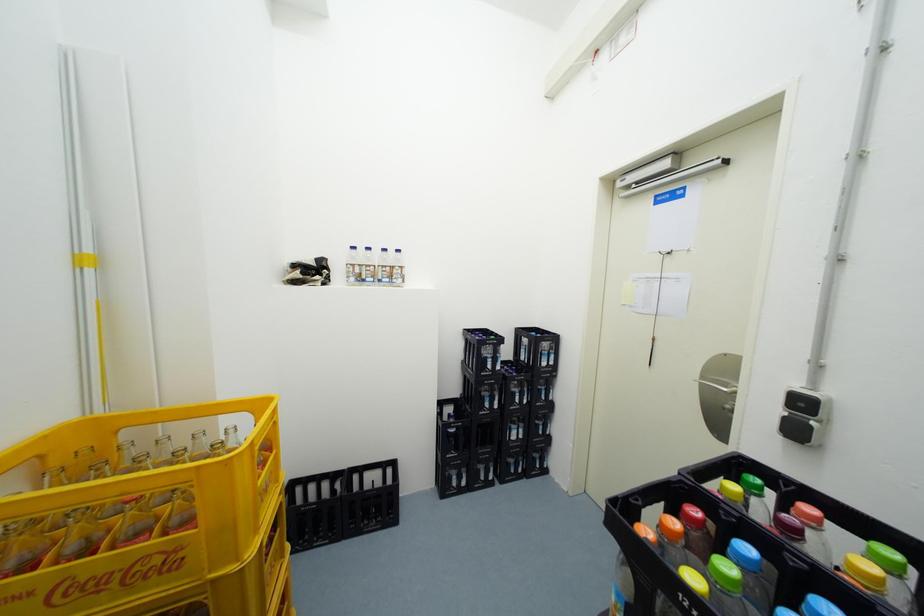
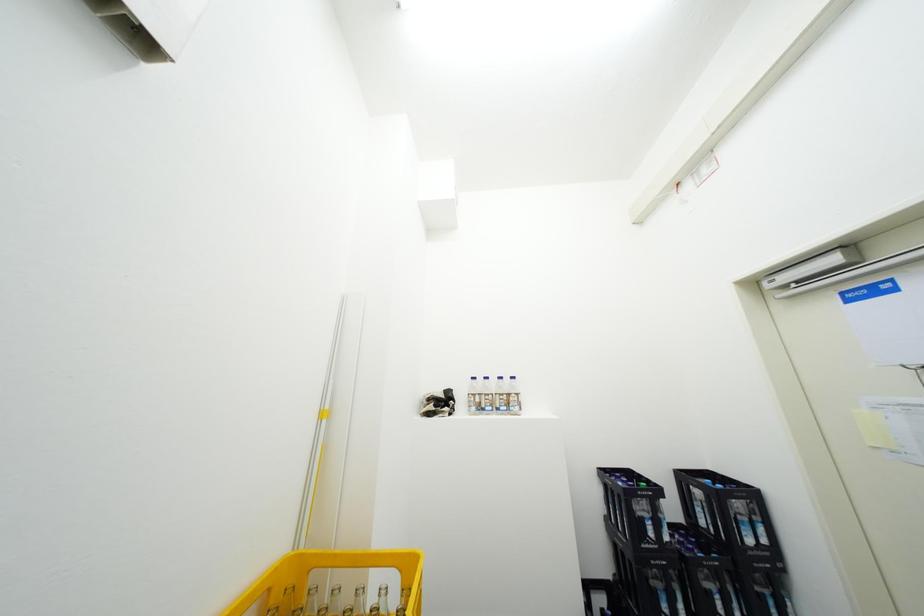
The first image is from the beginning of the video and the second image is from the end. How did the camera likely rotate when shooting the video?

The camera rotated toward left-up.